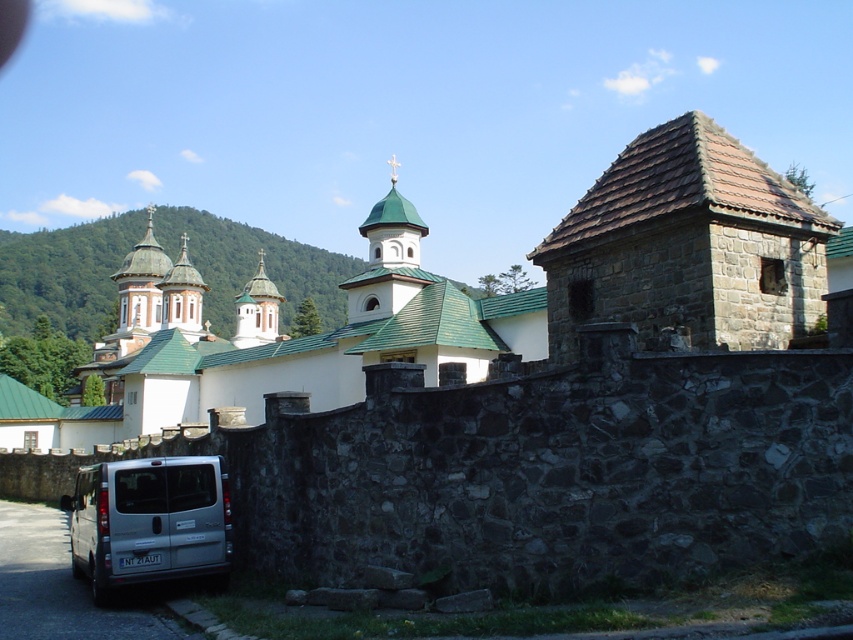
Question: Does white stone church at center lie behind green metallic dome at center?

Choices:
 (A) yes
 (B) no

Answer: (B)

Question: Is white stone church at center below silver metallic van at lower left?

Choices:
 (A) yes
 (B) no

Answer: (B)

Question: Which object is the farthest from the silver metallic van at lower left?

Choices:
 (A) green metallic dome at center
 (B) white stone church at center

Answer: (A)

Question: Considering the relative positions of white stone church at center and silver metallic van at lower left in the image provided, where is white stone church at center located with respect to silver metallic van at lower left?

Choices:
 (A) below
 (B) above

Answer: (B)

Question: Which point appears closest to the camera in this image?

Choices:
 (A) (801, 282)
 (B) (163, 477)

Answer: (B)

Question: Which point is farther to the camera?

Choices:
 (A) (134, 406)
 (B) (146, 476)
 (C) (384, 236)

Answer: (A)